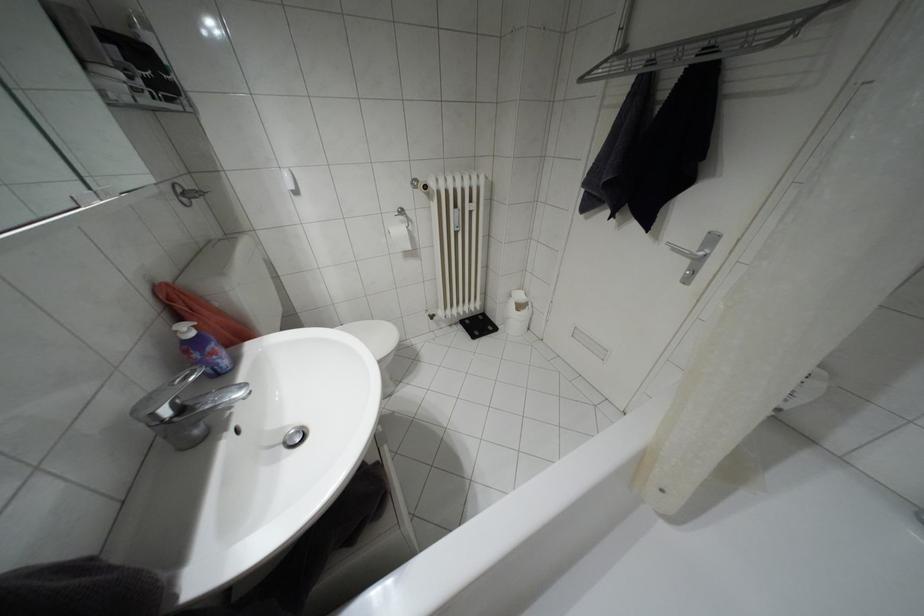
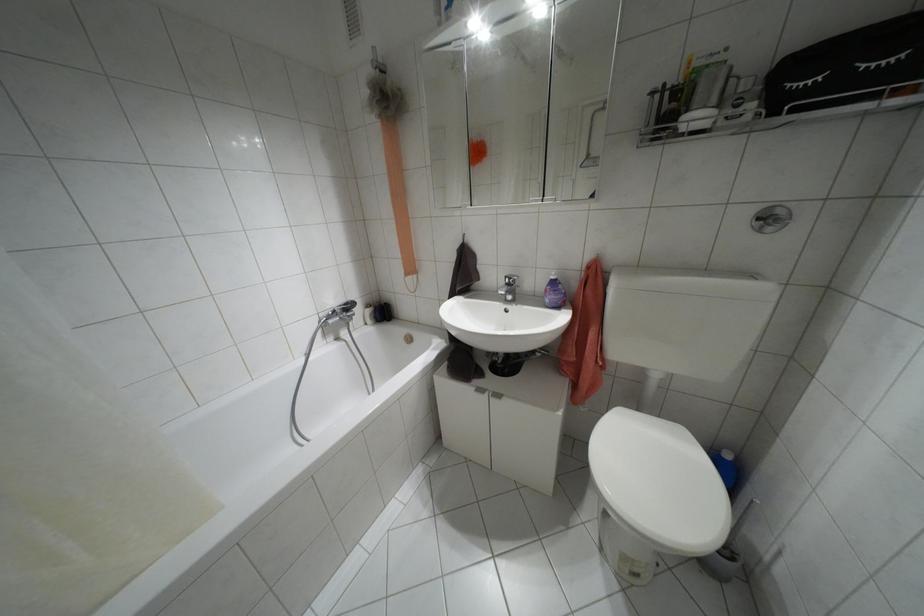
The point at [190,333] is marked in the first image. Where is the corresponding point in the second image?

(552, 277)